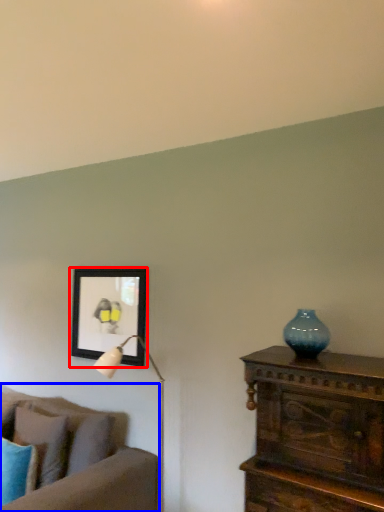
Question: Which object appears farthest to the camera in this image, picture frame (highlighted by a red box) or studio couch (highlighted by a blue box)?

Choices:
 (A) picture frame
 (B) studio couch

Answer: (A)